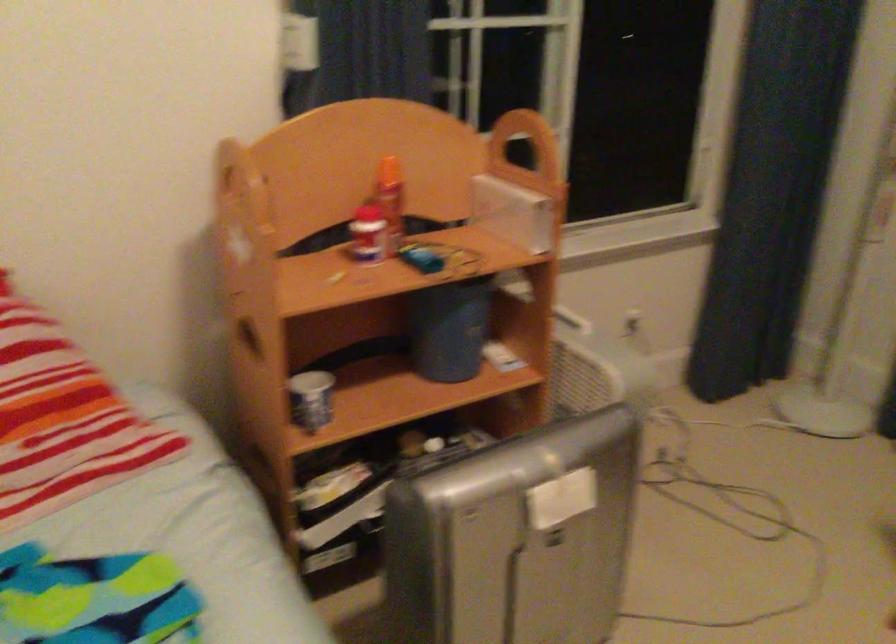
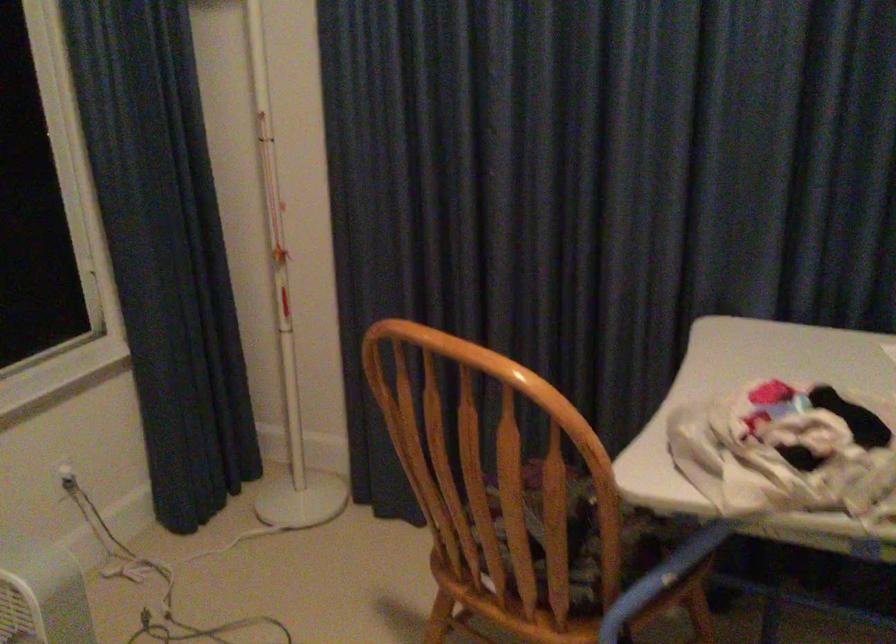
In the second image, find the point that corresponds to (640,317) in the first image.

(65, 478)